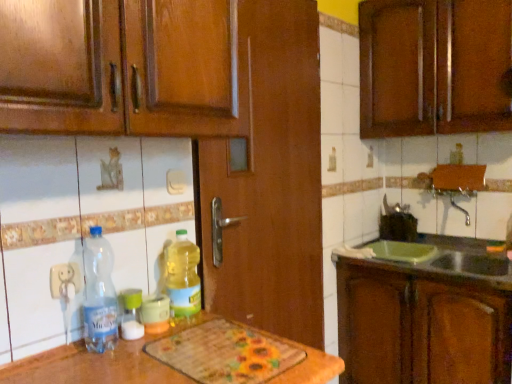
Question: Is translucent plastic bottle at center, the second bottle from the left, closer to camera compared to wooden cabinet at upper right, placed as the 2th cabinetry when sorted from bottom to top?

Choices:
 (A) yes
 (B) no

Answer: (A)

Question: From the image's perspective, would you say translucent plastic bottle at center, the second bottle from the left, is shown under wooden cabinet at upper right, placed as the 2th cabinetry when sorted from bottom to top?

Choices:
 (A) no
 (B) yes

Answer: (B)

Question: Would you say translucent plastic bottle at center, positioned as the second bottle in right-to-left order, is a long distance from wooden cabinet at upper right, placed as the 2th cabinetry when sorted from bottom to top?

Choices:
 (A) yes
 (B) no

Answer: (A)

Question: Is translucent plastic bottle at center, the second bottle from the left, not within wooden cabinet at upper right, which is the 1th cabinetry in top-to-bottom order?

Choices:
 (A) no
 (B) yes

Answer: (B)

Question: Is translucent plastic bottle at center, positioned as the second bottle in right-to-left order, with wooden cabinet at upper right, which is the 1th cabinetry in top-to-bottom order?

Choices:
 (A) yes
 (B) no

Answer: (B)

Question: From the image's perspective, is translucent plastic bottle at center, positioned as the second bottle in right-to-left order, above wooden cabinet at upper right, which is the 1th cabinetry in top-to-bottom order?

Choices:
 (A) yes
 (B) no

Answer: (B)

Question: Is green plastic sink at lower right to the left of translucent plastic bottle at center, the second bottle from the left, from the viewer's perspective?

Choices:
 (A) yes
 (B) no

Answer: (B)

Question: Is green plastic sink at lower right further to camera compared to translucent plastic bottle at center, the second bottle from the left?

Choices:
 (A) yes
 (B) no

Answer: (A)

Question: Considering the relative sizes of green plastic sink at lower right and translucent plastic bottle at center, the second bottle from the left, in the image provided, is green plastic sink at lower right thinner than translucent plastic bottle at center, the second bottle from the left,?

Choices:
 (A) no
 (B) yes

Answer: (A)

Question: From the image's perspective, is green plastic sink at lower right located beneath translucent plastic bottle at center, positioned as the second bottle in right-to-left order?

Choices:
 (A) no
 (B) yes

Answer: (B)

Question: Considering the relative sizes of green plastic sink at lower right and translucent plastic bottle at center, positioned as the second bottle in right-to-left order, in the image provided, is green plastic sink at lower right taller than translucent plastic bottle at center, positioned as the second bottle in right-to-left order,?

Choices:
 (A) yes
 (B) no

Answer: (A)

Question: Can you confirm if green plastic sink at lower right is bigger than translucent plastic bottle at center, the second bottle from the left?

Choices:
 (A) yes
 (B) no

Answer: (A)

Question: Is translucent plastic bottle at center, which ranks as the third bottle in left-to-right order, outside brown wood cabinet at right, marked as the first cabinetry in a bottom-to-top arrangement?

Choices:
 (A) yes
 (B) no

Answer: (A)